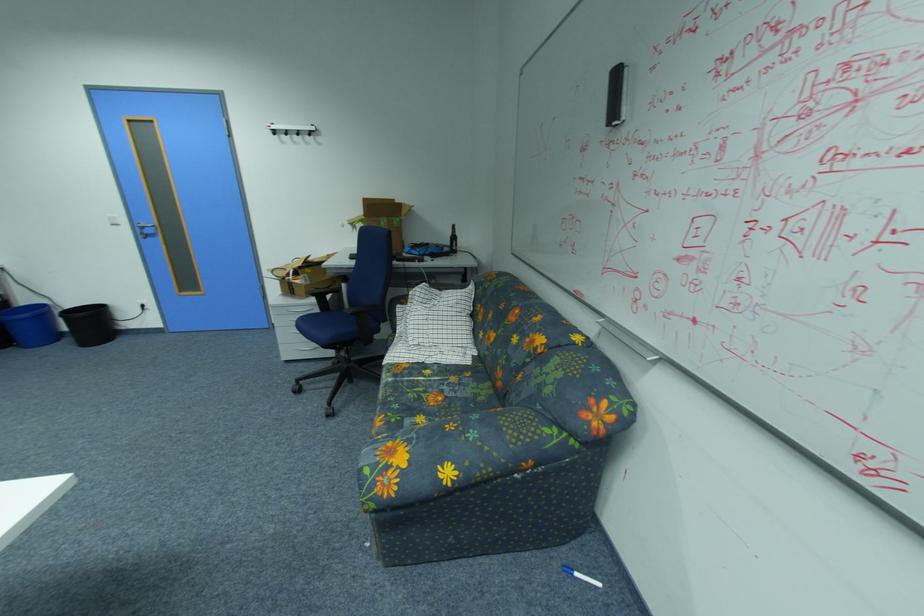
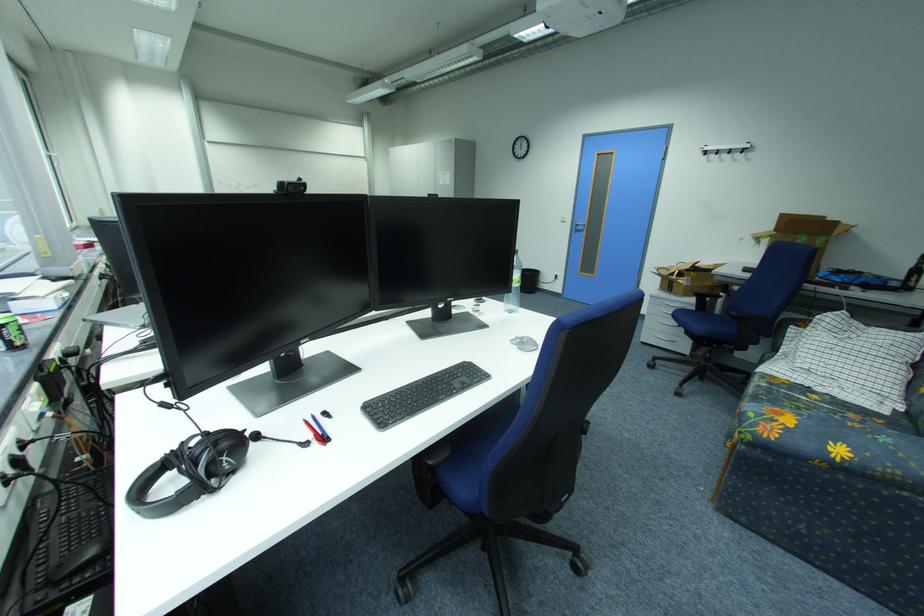
Find the pixel in the second image that matches pixel 129 227 in the first image.

(574, 223)